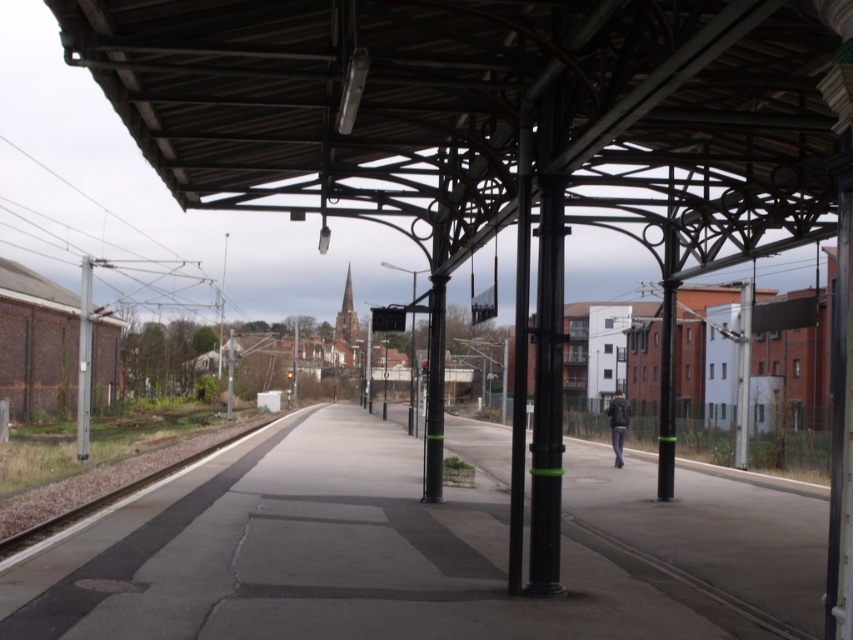
Is concrete platform at center closer to camera compared to metallic pole at left?

Yes, concrete platform at center is closer to the viewer.

Which is behind, point (374, 456) or point (78, 410)?

The point (78, 410) is behind.

In order to click on concrete platform at center in this screenshot , I will do [x=418, y=548].

Does black polished pole at center come behind dark gray jacket at right?

No, black polished pole at center is closer to the viewer.

Find the location of `black polished pole at center`. black polished pole at center is located at coordinates (519, 353).

Between black matte pole at center and metallic pole at left, which one has more height?

With more height is metallic pole at left.

Does black matte pole at center have a smaller size compared to metallic pole at left?

Correct, black matte pole at center occupies less space than metallic pole at left.

Which is behind, point (554, 323) or point (83, 388)?

Point (83, 388)

This screenshot has width=853, height=640. I want to click on black matte pole at center, so click(547, 394).